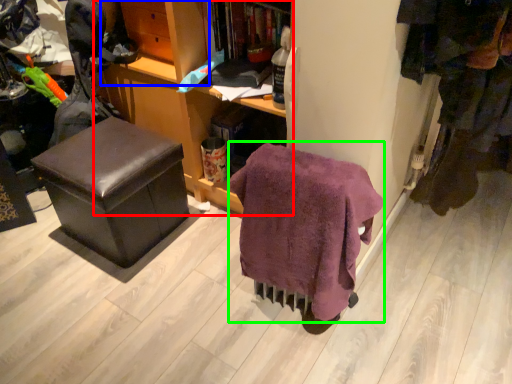
Question: Considering the real-world distances, which object is farthest from cabinetry (highlighted by a red box)? shelf (highlighted by a blue box) or blanket (highlighted by a green box)?

Choices:
 (A) shelf
 (B) blanket

Answer: (B)